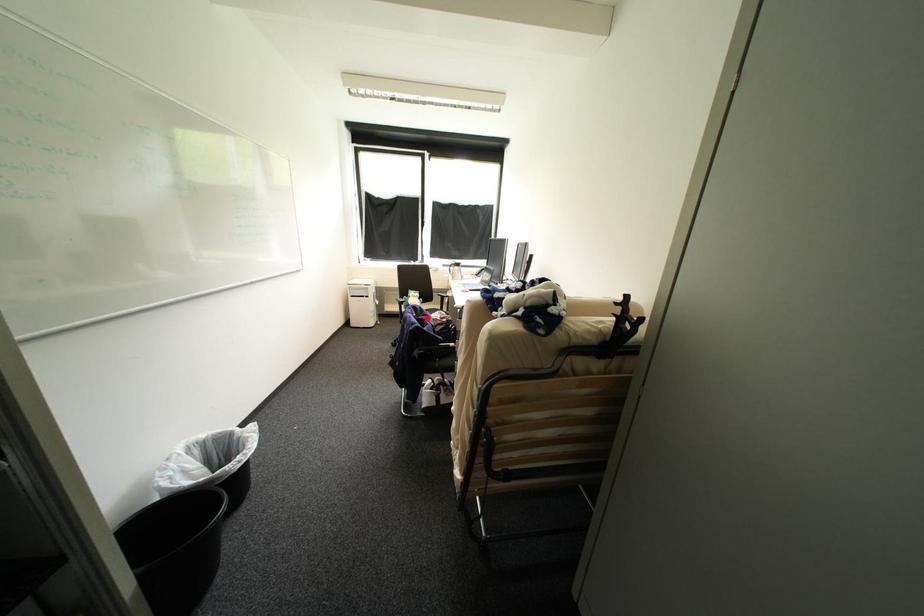
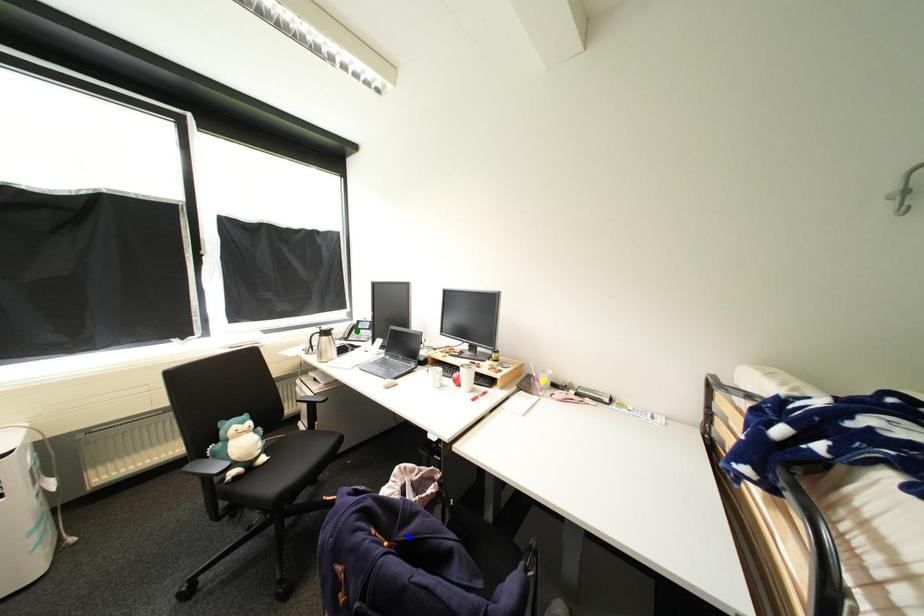
Question: I am providing you with two images of the same scene from different viewpoints. A red point is marked on the first image. You are given multiple points on the second image. In image 2, which mark is for the same physical point as the one in image 1?

Choices:
 (A) blue point
 (B) yellow point
 (C) green point

Answer: (A)